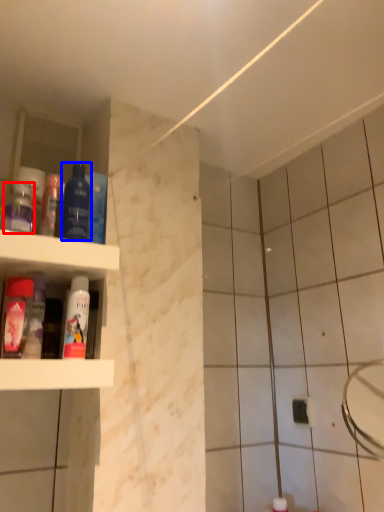
Question: Which object is further to the camera taking this photo, mouthwash (highlighted by a red box) or mouthwash (highlighted by a blue box)?

Choices:
 (A) mouthwash
 (B) mouthwash

Answer: (A)